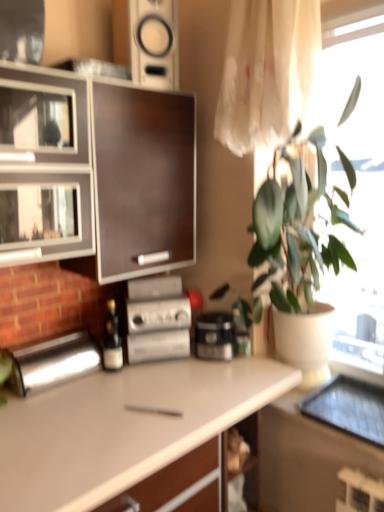
Identify the location of vacant area that lies in front of black plastic coffee maker at center. (223, 375).